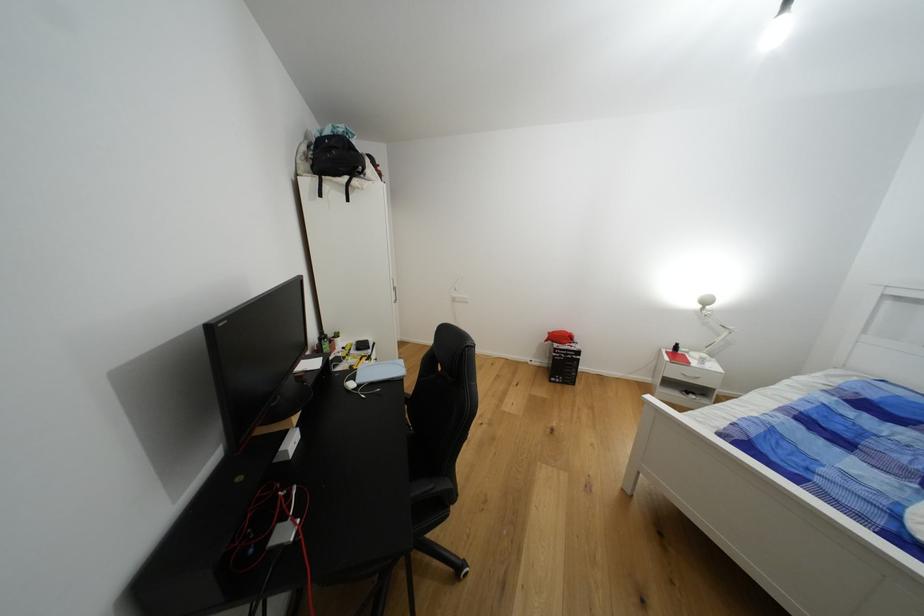
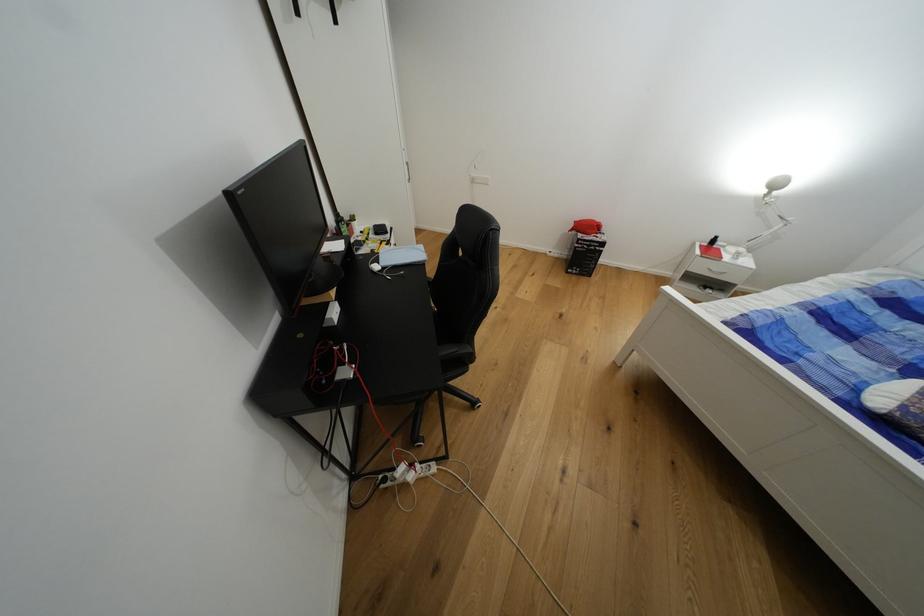
Where in the second image is the point corresponding to (x=706, y=309) from the first image?

(771, 193)